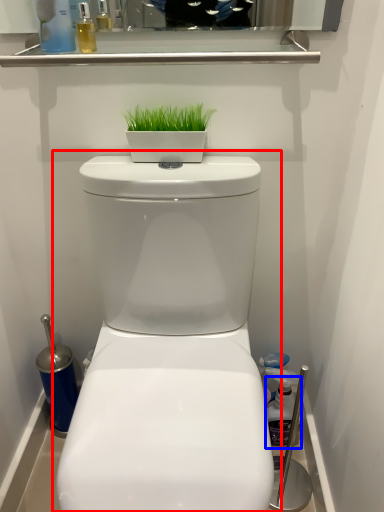
Question: Which of the following is the closest to the observer, toilet (highlighted by a red box) or cleaning product (highlighted by a blue box)?

Choices:
 (A) toilet
 (B) cleaning product

Answer: (A)